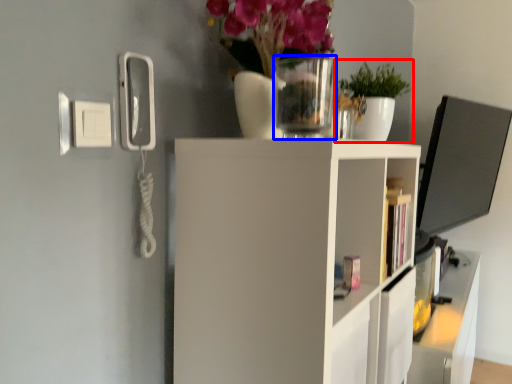
Question: Which point is closer to the camera, houseplant (highlighted by a red box) or glass vase (highlighted by a blue box)?

Choices:
 (A) houseplant
 (B) glass vase

Answer: (B)